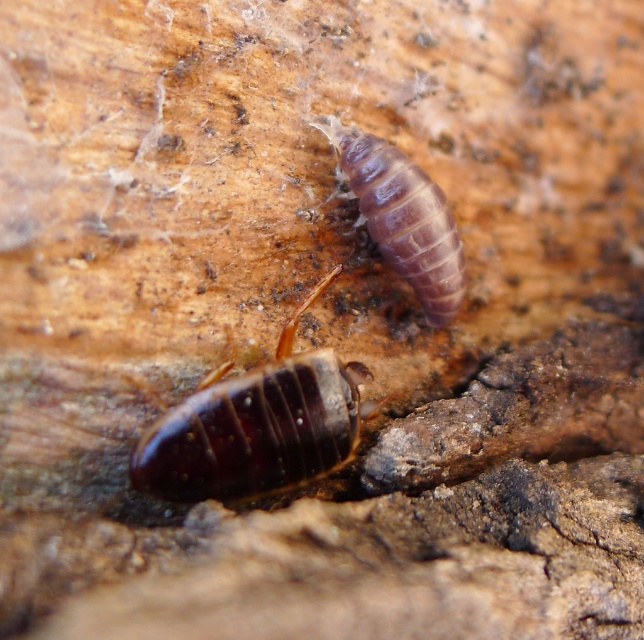
You are a researcher studying the spatial distribution of insects on wooden surfaces. You observe the shiny dark brown beetle at center and the purple matte worm at upper center. Based on their positions, can you determine if the beetle is closer to the edge of the wood than the worm?

The shiny dark brown beetle at center is 11.11 inches away from the purple matte worm at upper center. However, without knowing the distance from each insect to the edge of the wood, it is impossible to determine which is closer to the edge.

You are an entomologist examining a piece of weathered wood. You notice the shiny dark brown beetle at center and the purple matte worm at upper center. Which of these two creatures has a greater width?

The shiny dark brown beetle at center has a greater width than the purple matte worm at upper center.